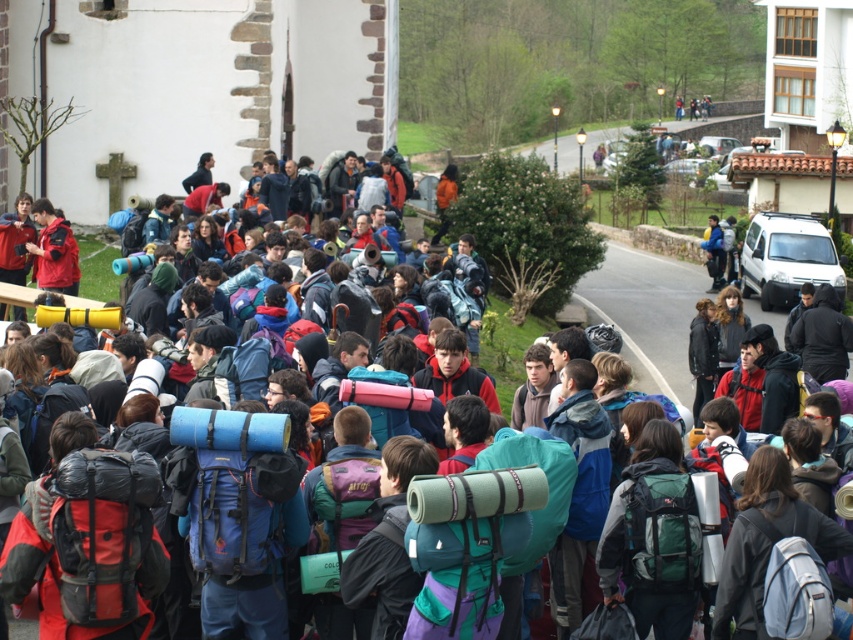
Question: Is blue fabric backpack at center wider than light blue fabric backpack at center?

Choices:
 (A) yes
 (B) no

Answer: (A)

Question: Can you confirm if red fabric backpack at center is wider than light blue fabric backpack at center?

Choices:
 (A) yes
 (B) no

Answer: (A)

Question: Does blue fabric backpack at center appear over green fabric backpack at center?

Choices:
 (A) yes
 (B) no

Answer: (A)

Question: Which point is closer to the camera?

Choices:
 (A) red fabric backpack at center
 (B) green fabric backpack at center
 (C) light blue fabric backpack at center

Answer: (C)

Question: Which point is closer to the camera taking this photo?

Choices:
 (A) (683, 589)
 (B) (280, 497)

Answer: (B)

Question: Among these points, which one is farthest from the camera?

Choices:
 (A) (694, 496)
 (B) (213, 518)

Answer: (A)